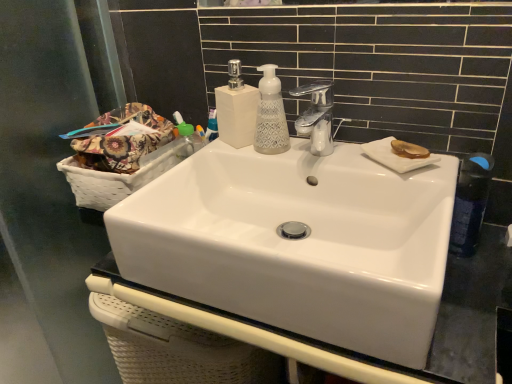
Question: From a real-world perspective, is blue plastic mouthwash at upper center positioned above or below white textured soap dispenser at center, placed as the second soap dispenser when sorted from left to right?

Choices:
 (A) above
 (B) below

Answer: (B)

Question: Considering the positions of point (204, 132) and point (282, 102), is point (204, 132) closer or farther from the camera than point (282, 102)?

Choices:
 (A) farther
 (B) closer

Answer: (A)

Question: Estimate the real-world distances between objects in this image. Which object is farther from the white glossy sink at center?

Choices:
 (A) transparent glass screen door at left
 (B) chrome metallic faucet at upper center
 (C) blue plastic mouthwash at upper center
 (D) white matte soap dispenser at center, which is the second soap dispenser from right to left
 (E) floral fabric basket at left

Answer: (A)

Question: Considering the real-world distances, which object is closest to the white woven basket at left?

Choices:
 (A) floral fabric basket at left
 (B) translucent amber plate at upper right
 (C) white textured soap dispenser at center, which is the 1th soap dispenser from right to left
 (D) chrome metallic faucet at upper center
 (E) white matte soap dispenser at center, which is the second soap dispenser from right to left

Answer: (A)